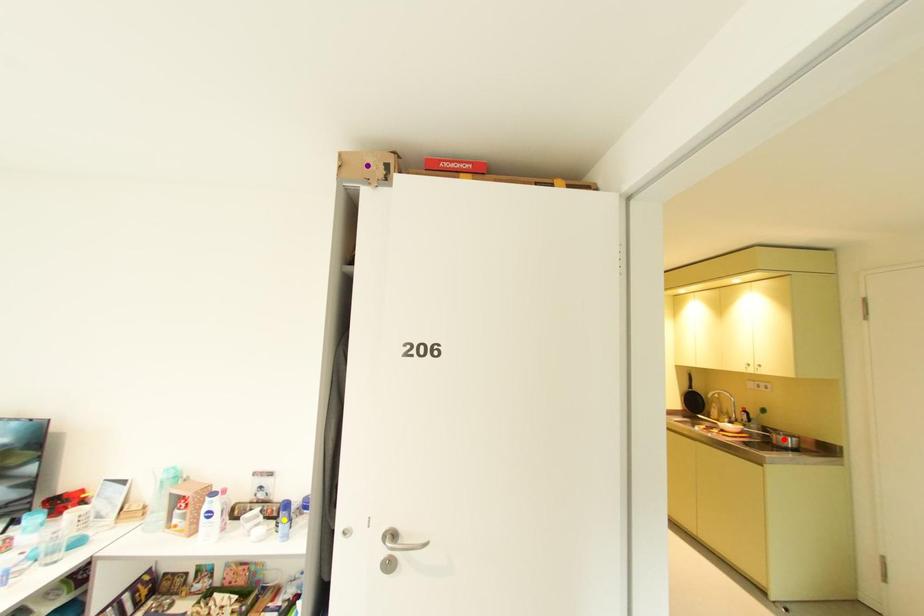
Order these from nearest to farthest:
purple point
yellow point
red point

purple point, yellow point, red point